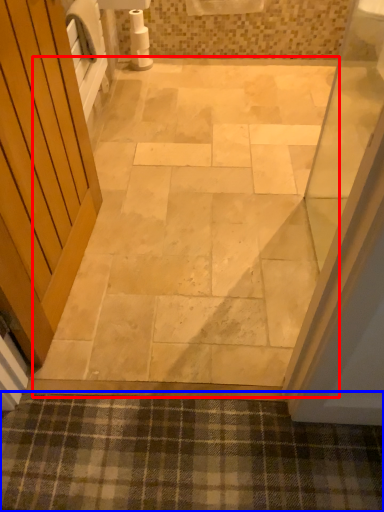
Question: Which of the following is the closest to the observer, path (highlighted by a red box) or bath mat (highlighted by a blue box)?

Choices:
 (A) path
 (B) bath mat

Answer: (B)